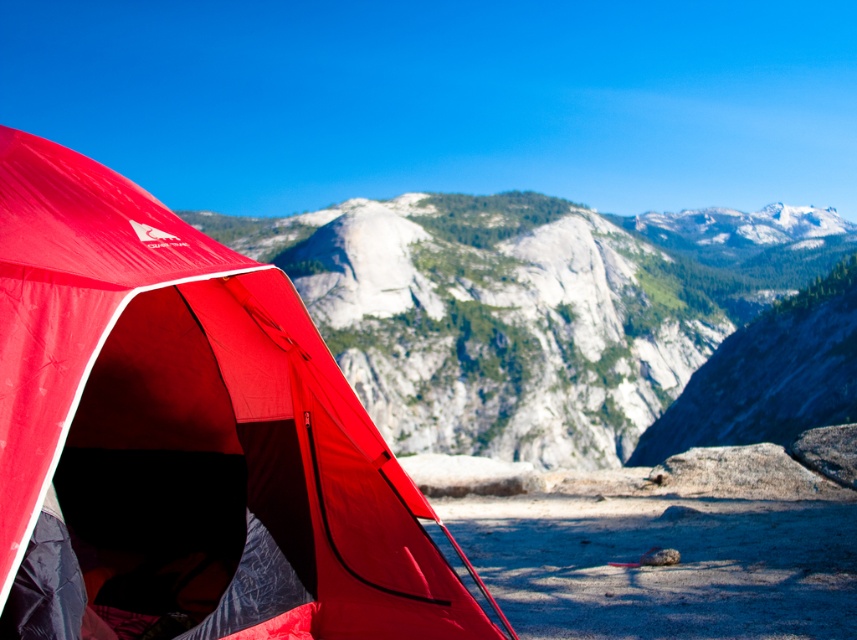
You are planning to set up a tent in a campsite and need to choose between the matte red tent at left and the matte gray rock at center. Based on their sizes, which one would take up more space in your camping area?

The matte gray rock at center occupies more space than the matte red tent at left, so it would take up more space in the camping area.

You are planning to set up a camping gear organizer that requires a space wider than the matte red tent at left. Can the matte gray rock at center provide enough width for this organizer?

The matte red tent at left is narrower than the matte gray rock at center, so the organizer requiring more width than the tent can be placed on the matte gray rock at center.